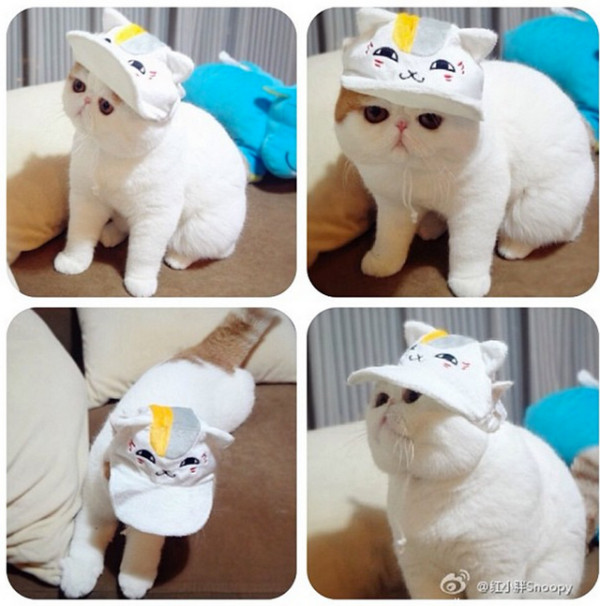
You are a GUI agent. You are given a task and a screenshot of the screen. Output one action in this format:
    pyautogui.click(x=<x>, y=<y>)
    Task: Click on the pillow
    
    Given the screenshot: What is the action you would take?
    pyautogui.click(x=60, y=351), pyautogui.click(x=92, y=325), pyautogui.click(x=32, y=197), pyautogui.click(x=316, y=85), pyautogui.click(x=338, y=508), pyautogui.click(x=530, y=431), pyautogui.click(x=548, y=42), pyautogui.click(x=245, y=82)